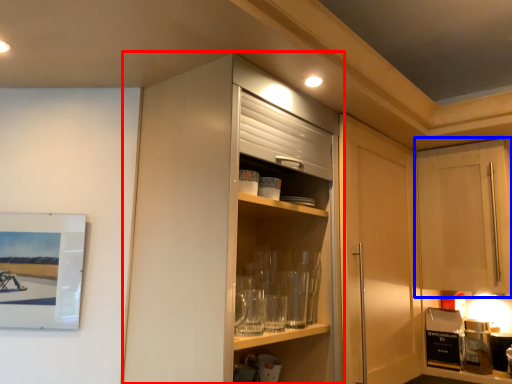
Question: Which point is closer to the camera, cabinetry (highlighted by a red box) or cabinetry (highlighted by a blue box)?

Choices:
 (A) cabinetry
 (B) cabinetry

Answer: (A)